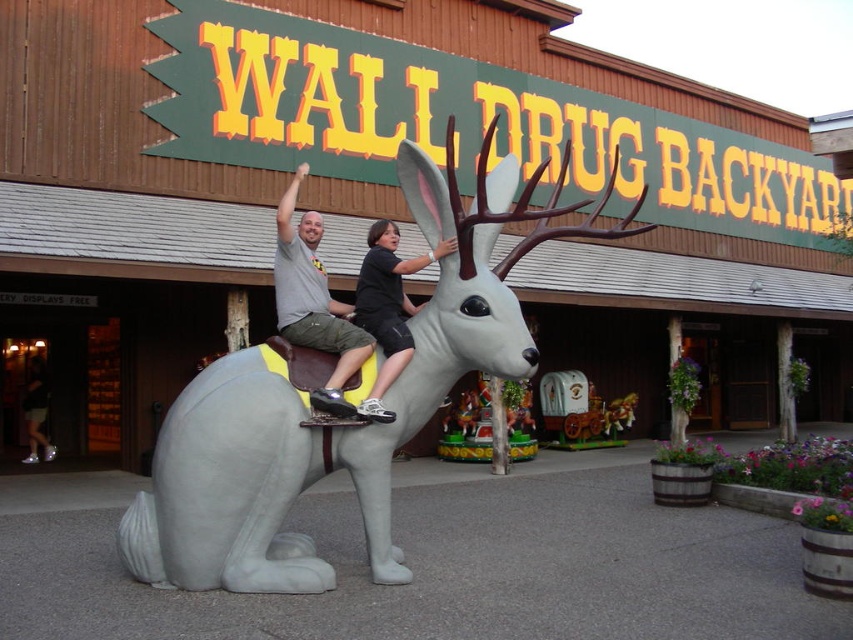
Question: Which object appears farthest from the camera in this image?

Choices:
 (A) gray matte deer at center
 (B) matte gray rabbit at center
 (C) black matte shirt at center

Answer: (C)

Question: Can you confirm if gray matte deer at center is positioned to the right of black matte shirt at center?

Choices:
 (A) yes
 (B) no

Answer: (B)

Question: Among these objects, which one is farthest from the camera?

Choices:
 (A) matte gray rabbit at center
 (B) gray matte deer at center
 (C) black matte shirt at center

Answer: (C)

Question: Is gray matte deer at center closer to the viewer compared to black matte shirt at center?

Choices:
 (A) yes
 (B) no

Answer: (A)

Question: Which of these objects is positioned farthest from the gray matte deer at center?

Choices:
 (A) matte gray rabbit at center
 (B) black matte shirt at center

Answer: (A)

Question: Does gray matte deer at center come behind black matte shirt at center?

Choices:
 (A) no
 (B) yes

Answer: (A)